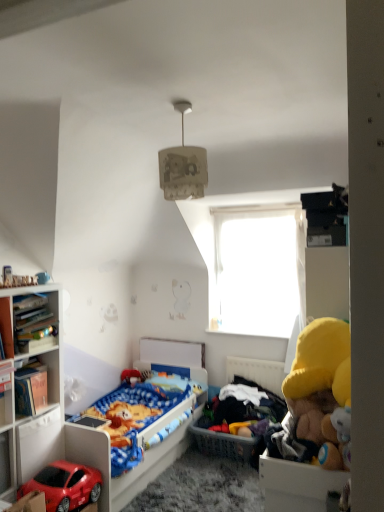
Question: Which is correct: white paper lampshade at upper center is inside wooden bookshelf at left, which appears as the 2th cabinet when viewed from the front, or outside of it?

Choices:
 (A) outside
 (B) inside

Answer: (A)

Question: In terms of height, does white paper lampshade at upper center look taller or shorter compared to wooden bookshelf at left, which is counted as the second cabinet, starting from the back?

Choices:
 (A) short
 (B) tall

Answer: (B)

Question: Estimate the real-world distances between objects in this image. Which object is farther from the plastic basket at center?

Choices:
 (A) transparent plastic window at upper center
 (B) wooden toy chest at lower right, the 3th cabinet from the left
 (C) matte white bookshelf at left, arranged as the first cabinet when viewed from the back
 (D) white paper lampshade at upper center
 (E) wooden bookshelf at left, which ranks as the 2th cabinet in right-to-left order

Answer: (D)

Question: Which object is positioned farthest from the white paper lampshade at upper center?

Choices:
 (A) matte plastic bed at lower left
 (B) wooden bookshelf at left, which appears as the 2th cabinet when viewed from the front
 (C) wooden toy chest at lower right, marked as the first cabinet in a right-to-left arrangement
 (D) transparent plastic window at upper center
 (E) shiny red toy car at lower left

Answer: (D)